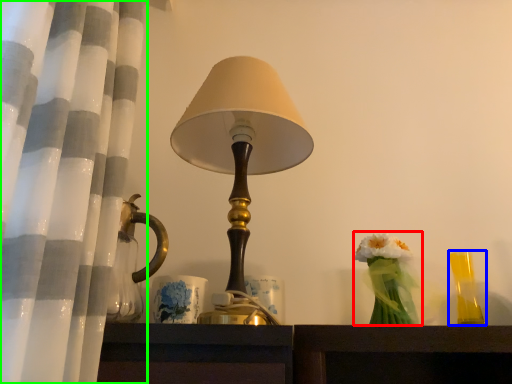
Question: Considering the real-world distances, which object is closest to floral arrangement (highlighted by a red box)? candle holder (highlighted by a blue box) or curtain (highlighted by a green box).

Choices:
 (A) candle holder
 (B) curtain

Answer: (A)